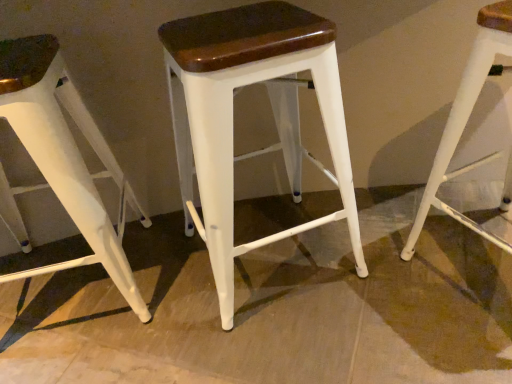
Question: Relative to white matte stool at center, placed as the 2th stool when sorted from right to left, is white matte stool at left, the 1th stool viewed from the left, in front or behind?

Choices:
 (A) front
 (B) behind

Answer: (B)

Question: Based on their sizes in the image, would you say white matte stool at left, placed as the 3th stool when sorted from right to left, is bigger or smaller than white matte stool at center, the 2th stool from the left?

Choices:
 (A) big
 (B) small

Answer: (B)

Question: Estimate the real-world distances between objects in this image. Which object is closer to the white matte stool at center, which is the 3th stool in left-to-right order?

Choices:
 (A) white matte stool at left, the 1th stool viewed from the left
 (B) white matte stool at center, the 2th stool from the left

Answer: (B)

Question: Which is nearer to the white matte stool at center, which is the 1th stool from right to left?

Choices:
 (A) white matte stool at left, placed as the 3th stool when sorted from right to left
 (B) white matte stool at center, placed as the 2th stool when sorted from right to left

Answer: (B)